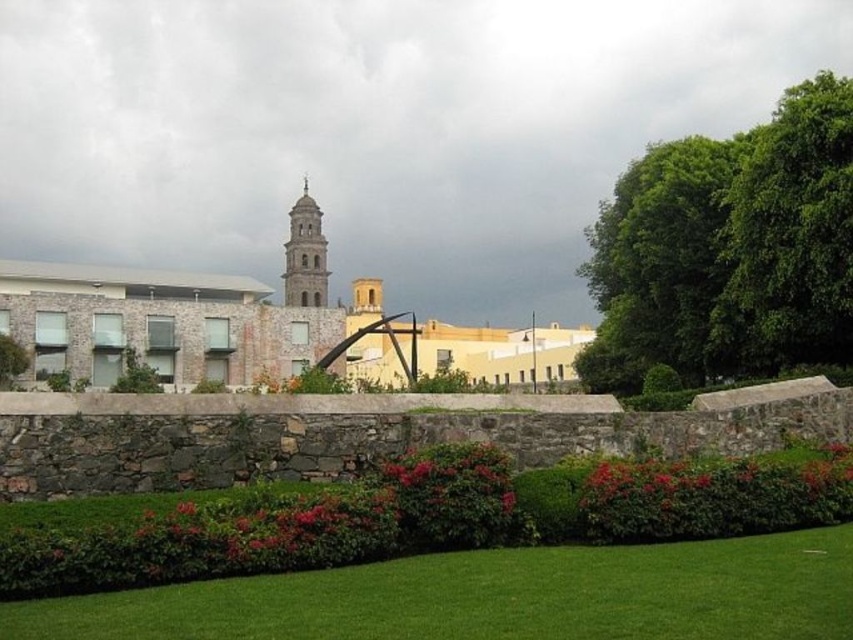
Is point (807, 227) positioned in front of point (323, 284)?

Yes, point (807, 227) is in front of point (323, 284).

Does green leafy tree at upper right lie behind smooth stone bell tower at center?

Answer: No, green leafy tree at upper right is in front of smooth stone bell tower at center.

Who is more forward, (792, 140) or (315, 230)?

Point (792, 140)

This screenshot has height=640, width=853. Identify the location of green leafy tree at upper right. (729, 250).

Who is positioned more to the left, green grass at lower center or smooth stone bell tower at center?

From the viewer's perspective, smooth stone bell tower at center appears more on the left side.

Is green grass at lower center positioned behind smooth stone bell tower at center?

No, it is in front of smooth stone bell tower at center.

Measure the distance between green grass at lower center and camera.

A distance of 14.99 meters exists between green grass at lower center and camera.

Find the location of a particular element. This screenshot has width=853, height=640. green grass at lower center is located at coordinates (494, 596).

Identify the location of green grass at lower center. Image resolution: width=853 pixels, height=640 pixels. (494, 596).

Is green grass at lower center to the right of green leafy tree at upper right from the viewer's perspective?

In fact, green grass at lower center is to the left of green leafy tree at upper right.

Between point (680, 596) and point (648, 211), which one is positioned in front?

Point (680, 596) is in front.

You are a GUI agent. You are given a task and a screenshot of the screen. Output one action in this format:
    pyautogui.click(x=<x>, y=<y>)
    Task: Click on the green grass at lower center
    Image resolution: width=853 pixels, height=640 pixels.
    Given the screenshot: What is the action you would take?
    pyautogui.click(x=494, y=596)